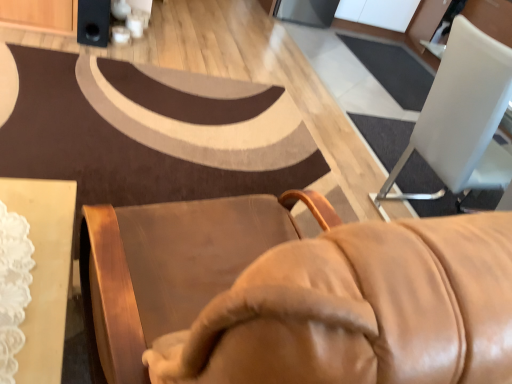
This screenshot has width=512, height=384. I want to click on white plastic chair at upper right, so click(x=462, y=118).

Describe the element at coordinates (462, 118) in the screenshot. Image resolution: width=512 pixels, height=384 pixels. I see `white plastic chair at upper right` at that location.

What is the approximate width of white plastic chair at upper right?

The width of white plastic chair at upper right is 24.83 inches.

This screenshot has height=384, width=512. What do you see at coordinates (93, 22) in the screenshot?
I see `black matte speaker at upper left` at bounding box center [93, 22].

Locate an element on the screen. Image resolution: width=512 pixels, height=384 pixels. black matte speaker at upper left is located at coordinates (93, 22).

Locate an element on the screen. white plastic chair at upper right is located at coordinates (462, 118).

Between black matte speaker at upper left and white plastic chair at upper right, which one appears on the right side from the viewer's perspective?

white plastic chair at upper right.

Which object is further away from the camera taking this photo, black matte speaker at upper left or white plastic chair at upper right?

black matte speaker at upper left is further away from the camera.

Which is in front, point (100, 44) or point (431, 149)?

The point (431, 149) is closer.

From the image's perspective, is black matte speaker at upper left located above or below white plastic chair at upper right?

Based on their image positions, black matte speaker at upper left is located above white plastic chair at upper right.

From a real-world perspective, which is physically above, black matte speaker at upper left or white plastic chair at upper right?

white plastic chair at upper right is physically above.

Consider the image. Considering the sizes of objects black matte speaker at upper left and white plastic chair at upper right in the image provided, who is thinner, black matte speaker at upper left or white plastic chair at upper right?

black matte speaker at upper left is thinner.

Between black matte speaker at upper left and white plastic chair at upper right, which one has more height?

Standing taller between the two is white plastic chair at upper right.

Between black matte speaker at upper left and white plastic chair at upper right, which one has smaller size?

black matte speaker at upper left.

Is black matte speaker at upper left inside the boundaries of white plastic chair at upper right, or outside?

black matte speaker at upper left exists outside the volume of white plastic chair at upper right.

Is black matte speaker at upper left positioned far away from white plastic chair at upper right?

black matte speaker at upper left is positioned a significant distance from white plastic chair at upper right.

Based on the photo, is black matte speaker at upper left turned away from white plastic chair at upper right?

No, black matte speaker at upper left is not facing the opposite direction of white plastic chair at upper right.

Can you tell me how much black matte speaker at upper left and white plastic chair at upper right differ in facing direction?

The facing directions of black matte speaker at upper left and white plastic chair at upper right are 94.1 degrees apart.

Measure the distance between black matte speaker at upper left and white plastic chair at upper right.

A distance of 6.81 feet exists between black matte speaker at upper left and white plastic chair at upper right.

Find the location of `chair below the black matte speaker at upper left (from the image's perspective)`. chair below the black matte speaker at upper left (from the image's perspective) is located at coordinates (462, 118).

Which is more to the left, white plastic chair at upper right or black matte speaker at upper left?

black matte speaker at upper left.

Consider the image. Which object is further away from the camera taking this photo, white plastic chair at upper right or black matte speaker at upper left?

black matte speaker at upper left.

Does point (497, 79) lie behind point (92, 21)?

That is False.

From the image's perspective, would you say white plastic chair at upper right is positioned over black matte speaker at upper left?

Actually, white plastic chair at upper right appears below black matte speaker at upper left in the image.

From a real-world perspective, is white plastic chair at upper right located higher than black matte speaker at upper left?

Indeed, from a real-world perspective, white plastic chair at upper right stands above black matte speaker at upper left.

Does white plastic chair at upper right have a greater width compared to black matte speaker at upper left?

Yes, white plastic chair at upper right is wider than black matte speaker at upper left.

Between white plastic chair at upper right and black matte speaker at upper left, which one has less height?

black matte speaker at upper left is shorter.

Is white plastic chair at upper right bigger than black matte speaker at upper left?

Yes.

Is white plastic chair at upper right inside the boundaries of black matte speaker at upper left, or outside?

white plastic chair at upper right is not enclosed by black matte speaker at upper left.

Is white plastic chair at upper right not near black matte speaker at upper left?

Yes, white plastic chair at upper right and black matte speaker at upper left are located far from each other.

Is white plastic chair at upper right facing towards black matte speaker at upper left?

No.

How far apart are white plastic chair at upper right and black matte speaker at upper left?

white plastic chair at upper right is 2.08 meters from black matte speaker at upper left.

Where is `speaker above the white plastic chair at upper right (from the image's perspective)`? The image size is (512, 384). speaker above the white plastic chair at upper right (from the image's perspective) is located at coordinates (93, 22).

Where is `chair located on the right of black matte speaker at upper left`? chair located on the right of black matte speaker at upper left is located at coordinates (462, 118).

The width and height of the screenshot is (512, 384). Find the location of `chair that is above the black matte speaker at upper left (from a real-world perspective)`. chair that is above the black matte speaker at upper left (from a real-world perspective) is located at coordinates (462, 118).